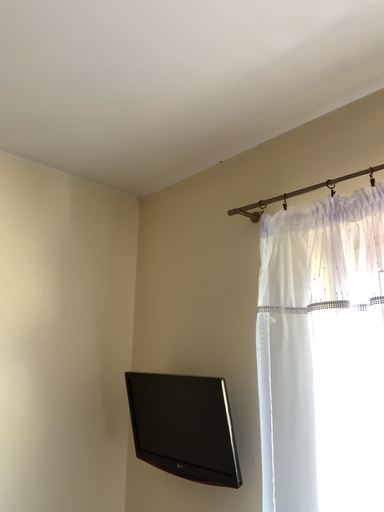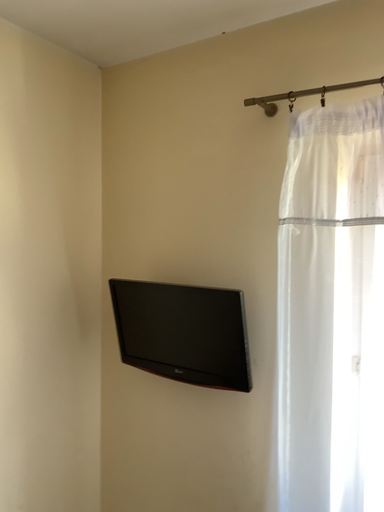
Question: How did the camera likely rotate when shooting the video?

Choices:
 (A) rotated right
 (B) rotated left

Answer: (A)